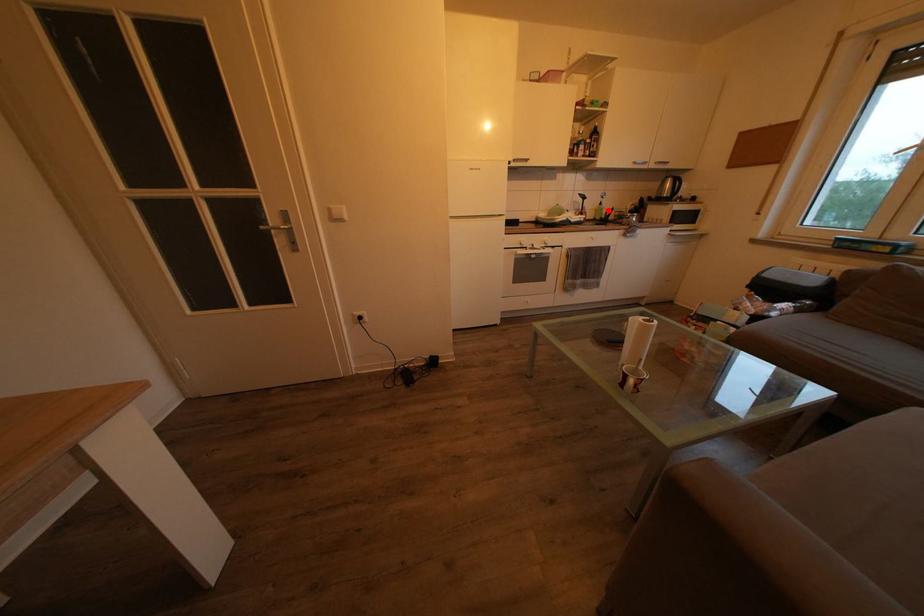
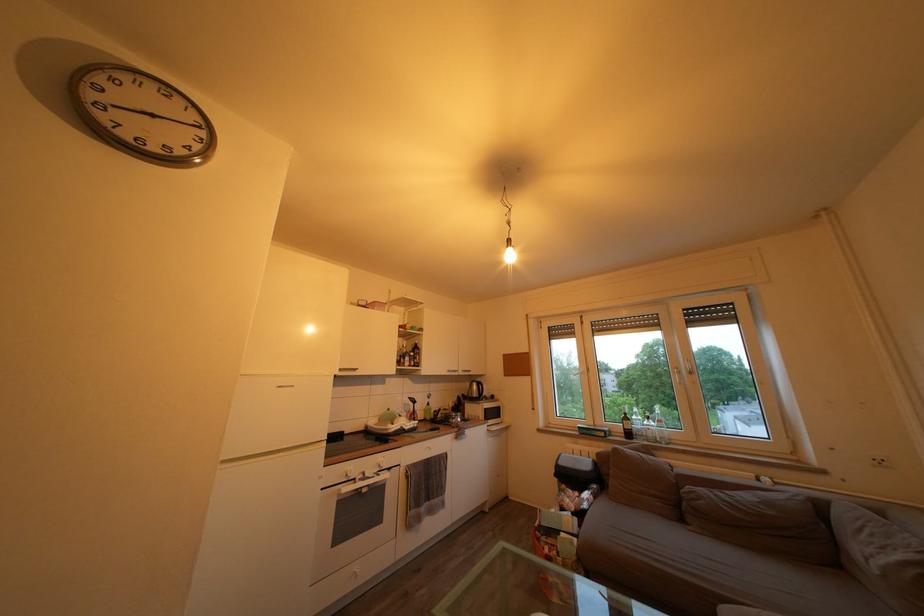
The point at the highlighted location is marked in the first image. Where is the corresponding point in the second image?

(436, 411)